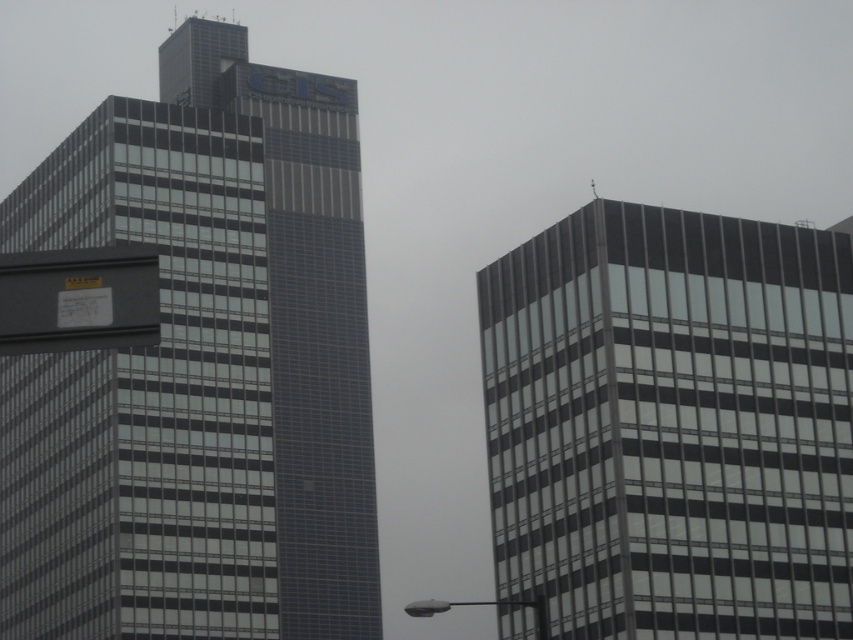
Between point (97, 630) and point (239, 100), which one is positioned in front?

Point (97, 630) is in front.

Who is lower down, glassy steel skyscraper at left or glassy steel skyscraper at center?

glassy steel skyscraper at left

What do you see at coordinates (201, 369) in the screenshot? I see `glassy steel skyscraper at left` at bounding box center [201, 369].

The width and height of the screenshot is (853, 640). In order to click on glassy steel skyscraper at left in this screenshot , I will do `click(201, 369)`.

Between glassy steel skyscraper at left and glassy gray building at right, which one is positioned lower?

glassy steel skyscraper at left is lower down.

Between glassy steel skyscraper at left and glassy gray building at right, which one has more height?

glassy steel skyscraper at left is taller.

The image size is (853, 640). I want to click on glassy steel skyscraper at left, so click(201, 369).

Where is `glassy steel skyscraper at left`? glassy steel skyscraper at left is located at coordinates (201, 369).

Is glassy gray building at right thinner than black matte sign at upper left?

No, glassy gray building at right is not thinner than black matte sign at upper left.

Between glassy gray building at right and black matte sign at upper left, which one appears on the right side from the viewer's perspective?

glassy gray building at right is more to the right.

Is point (746, 401) more distant than point (7, 301)?

That is True.

What are the coordinates of `glassy gray building at right` in the screenshot? It's located at (671, 424).